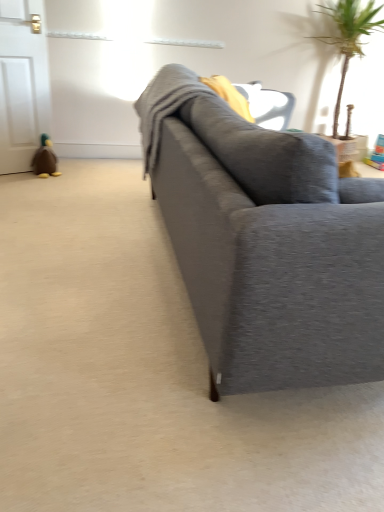
Where is `blank space to the left of matte gray couch at center`? This screenshot has height=512, width=384. blank space to the left of matte gray couch at center is located at coordinates (75, 247).